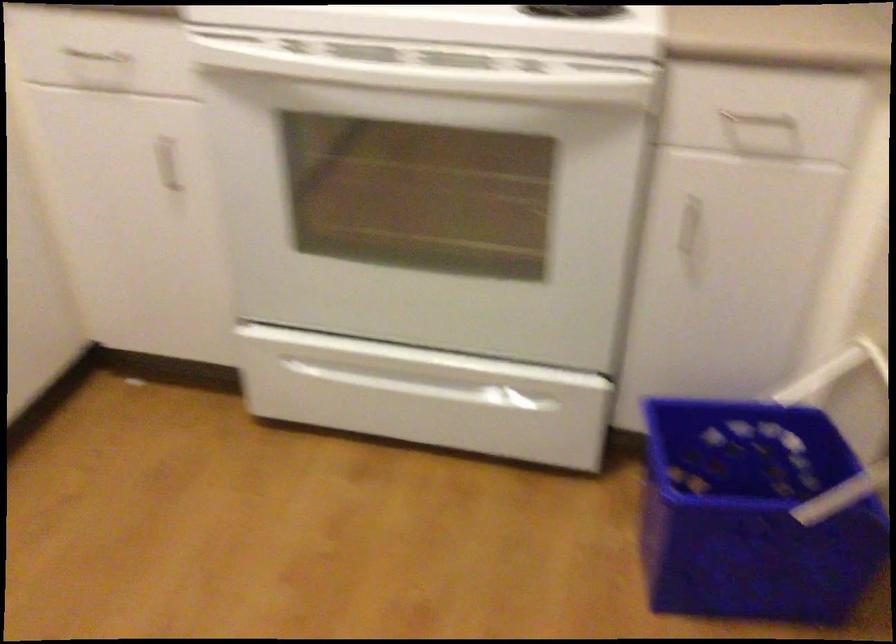
Find where to pull the oven drawer handle. Please return your answer as a coordinate pair (x, y).

(435, 379)